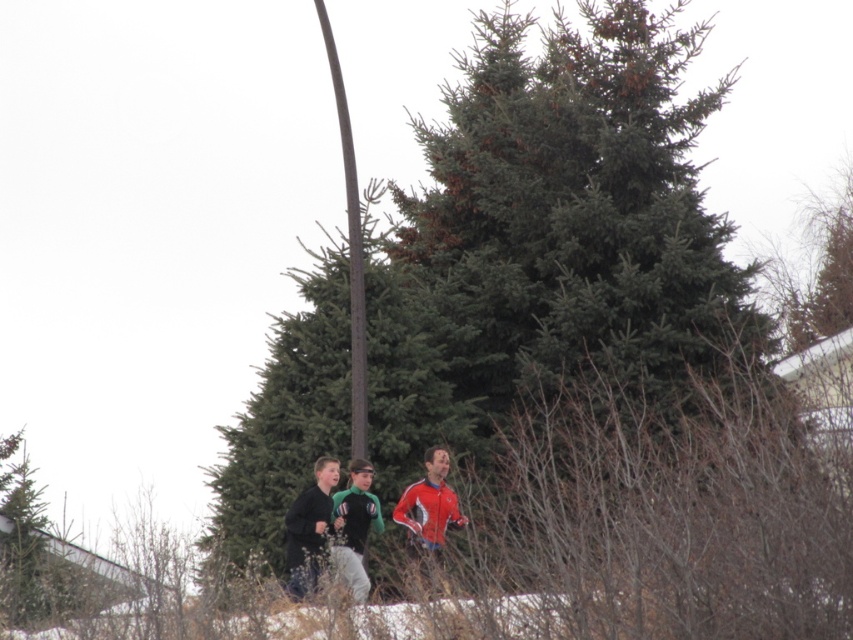
Consider the image. You are a photographer wanting to capture a photo of the brown textured pole at center and the red and white synthetic jacket at center. Based on their positions, which object is higher in the image?

The brown textured pole at center is above the red and white synthetic jacket at center, so it is higher in the image.